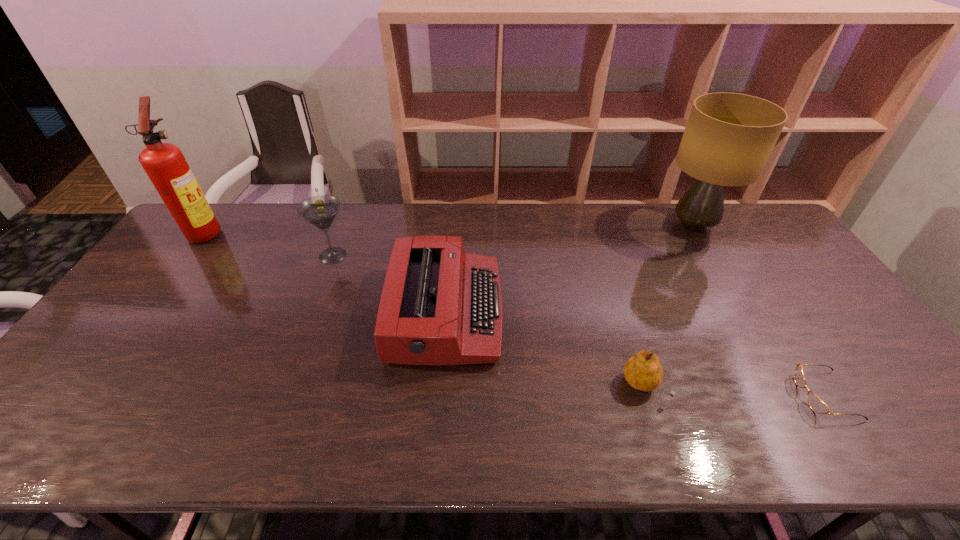
In order to click on free space in the image that satisfies the following two spatial constraints: 1. on the front-facing side of the leftmost object; 2. on the left side of the second object from left to right in this screenshot , I will do `click(188, 255)`.

Locate an element on the screen. The width and height of the screenshot is (960, 540). free space in the image that satisfies the following two spatial constraints: 1. on the back side of the third object from right to left; 2. on the front-facing side of the fire extinguisher is located at coordinates (594, 232).